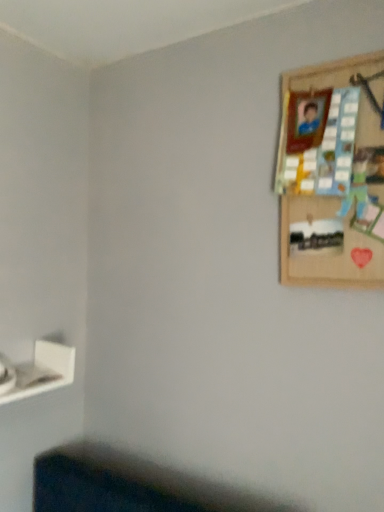
Describe the element at coordinates (39, 372) in the screenshot. I see `white matte shelf at lower left` at that location.

What is the approximate width of white matte shelf at lower left?

It is 7.44 inches.

Find the location of a particular element. This screenshot has height=512, width=384. white matte shelf at lower left is located at coordinates (39, 372).

The image size is (384, 512). What do you see at coordinates (334, 179) in the screenshot? I see `wooden picture frame at upper right` at bounding box center [334, 179].

Where is `wooden picture frame at upper right`? This screenshot has width=384, height=512. wooden picture frame at upper right is located at coordinates (334, 179).

What is the approximate width of wooden picture frame at upper right?

2.08 inches.

Find the location of a particular element. The image size is (384, 512). white matte shelf at lower left is located at coordinates (39, 372).

Can you confirm if wooden picture frame at upper right is positioned to the left of white matte shelf at lower left?

No.

Which object is closer to the camera taking this photo, wooden picture frame at upper right or white matte shelf at lower left?

wooden picture frame at upper right.

Which is behind, point (329, 191) or point (63, 380)?

The point (63, 380) is behind.

From the image's perspective, is wooden picture frame at upper right located above or below white matte shelf at lower left?

Clearly, from the image's perspective, wooden picture frame at upper right is above white matte shelf at lower left.

From a real-world perspective, who is located lower, wooden picture frame at upper right or white matte shelf at lower left?

From a 3D spatial view, white matte shelf at lower left is below.

Is wooden picture frame at upper right wider or thinner than white matte shelf at lower left?

wooden picture frame at upper right is thinner than white matte shelf at lower left.

Is wooden picture frame at upper right taller than white matte shelf at lower left?

Indeed, wooden picture frame at upper right has a greater height compared to white matte shelf at lower left.

Is wooden picture frame at upper right bigger than white matte shelf at lower left?

Indeed, wooden picture frame at upper right has a larger size compared to white matte shelf at lower left.

Could white matte shelf at lower left be considered to be inside wooden picture frame at upper right?

No.

Is wooden picture frame at upper right in contact with white matte shelf at lower left?

No, wooden picture frame at upper right is not with white matte shelf at lower left.

Is white matte shelf at lower left at the back of wooden picture frame at upper right?

No.

Find the location of a particular element. This screenshot has width=384, height=512. picture frame located on the right of white matte shelf at lower left is located at coordinates (334, 179).

Which is more to the right, white matte shelf at lower left or wooden picture frame at upper right?

wooden picture frame at upper right.

Which is in front, white matte shelf at lower left or wooden picture frame at upper right?

wooden picture frame at upper right is closer to the camera.

Is point (46, 347) closer to camera compared to point (323, 144)?

No, it is not.

From the image's perspective, who appears lower, white matte shelf at lower left or wooden picture frame at upper right?

white matte shelf at lower left, from the image's perspective.

From a real-world perspective, relative to wooden picture frame at upper right, is white matte shelf at lower left vertically above or below?

From a real-world perspective, white matte shelf at lower left is physically below wooden picture frame at upper right.

In terms of width, does white matte shelf at lower left look wider or thinner when compared to wooden picture frame at upper right?

In the image, white matte shelf at lower left appears to be wider than wooden picture frame at upper right.

Considering the relative sizes of white matte shelf at lower left and wooden picture frame at upper right in the image provided, is white matte shelf at lower left taller than wooden picture frame at upper right?

No.

Which of these two, white matte shelf at lower left or wooden picture frame at upper right, is smaller?

With smaller size is white matte shelf at lower left.

Is wooden picture frame at upper right surrounded by white matte shelf at lower left?

Definitely not — wooden picture frame at upper right is not inside white matte shelf at lower left.

Is white matte shelf at lower left positioned far away from wooden picture frame at upper right?

white matte shelf at lower left is near wooden picture frame at upper right, not far away.

Could you tell me if white matte shelf at lower left is facing wooden picture frame at upper right?

No, white matte shelf at lower left is not aimed at wooden picture frame at upper right.

How many degrees apart are the facing directions of white matte shelf at lower left and wooden picture frame at upper right?

The facing directions of white matte shelf at lower left and wooden picture frame at upper right are 88.4 degrees apart.

How distant is white matte shelf at lower left from wooden picture frame at upper right?

white matte shelf at lower left is 37.90 inches away from wooden picture frame at upper right.

What are the coordinates of `shelf lying behind the wooden picture frame at upper right` in the screenshot? It's located at (39, 372).

Where is `picture frame located above the white matte shelf at lower left (from a real-world perspective)`? picture frame located above the white matte shelf at lower left (from a real-world perspective) is located at coordinates (334, 179).

Locate an element on the screen. The width and height of the screenshot is (384, 512). picture frame located above the white matte shelf at lower left (from the image's perspective) is located at coordinates (334, 179).